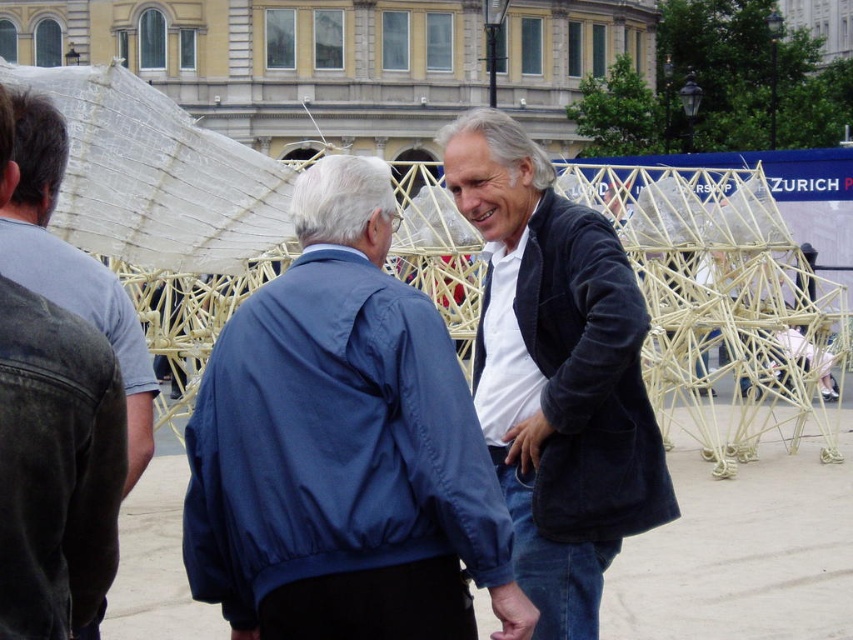
Question: Which of the following is the closest to the observer?

Choices:
 (A) denim jacket at left
 (B) dark blue fabric jacket at lower left
 (C) velvet blue jacket at center
 (D) blue fabric jacket at center

Answer: (B)

Question: From the image, what is the correct spatial relationship of velvet blue jacket at center in relation to denim jacket at left?

Choices:
 (A) right
 (B) left

Answer: (A)

Question: Is blue fabric jacket at center behind velvet blue jacket at center?

Choices:
 (A) no
 (B) yes

Answer: (A)

Question: Based on their relative distances, which object is nearer to the blue fabric jacket at center?

Choices:
 (A) velvet blue jacket at center
 (B) dark blue fabric jacket at lower left

Answer: (A)

Question: Which of these objects is positioned farthest from the denim jacket at left?

Choices:
 (A) dark blue fabric jacket at lower left
 (B) velvet blue jacket at center

Answer: (B)

Question: Can you confirm if blue fabric jacket at center is thinner than denim jacket at left?

Choices:
 (A) no
 (B) yes

Answer: (A)